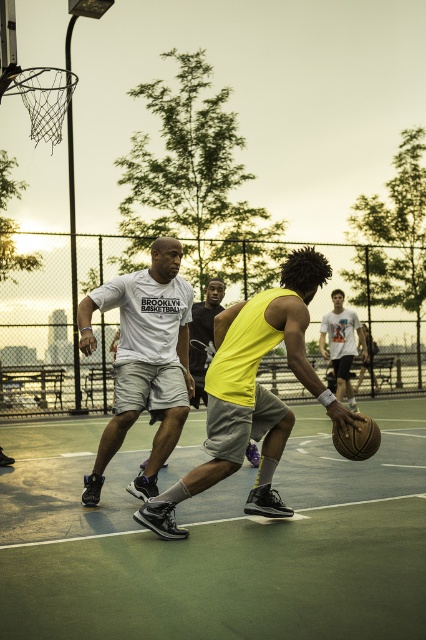
You are a photographer setting up a tripod to capture the basketball game. You want to ensure both the green rubber basketball court at center and the metallic silver basketball hoop at upper left are visible in your shot. Considering their heights, which object will appear closer to the bottom of the frame?

The green rubber basketball court at center has a lesser height compared to the metallic silver basketball hoop at upper left, so it will appear closer to the bottom of the frame.